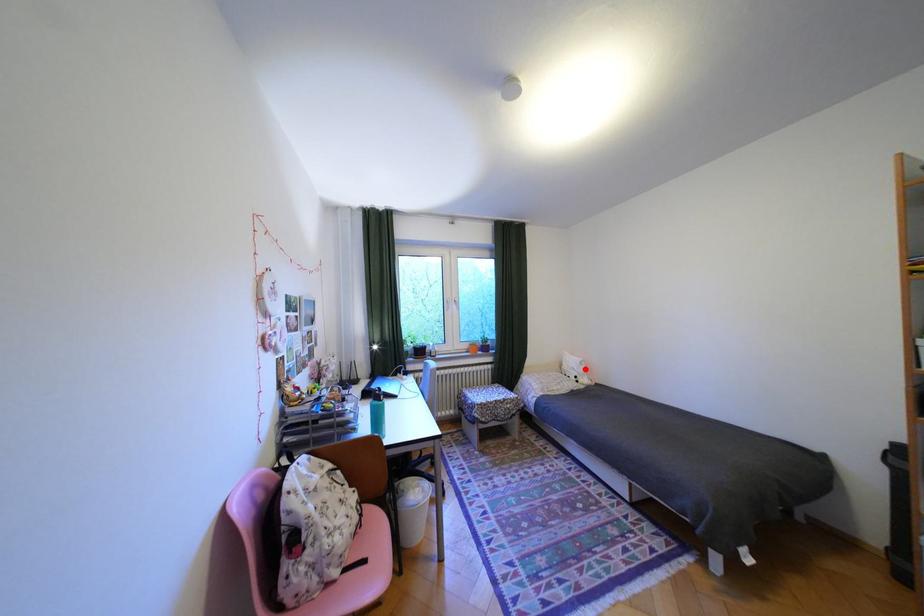
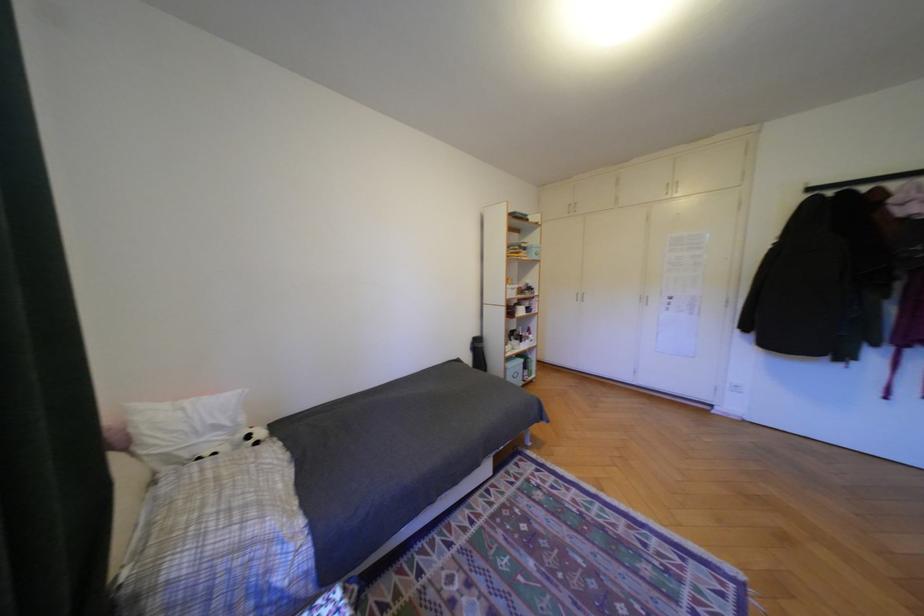
Question: A red point is marked in image1. In image2, is the corresponding 3D point closer to the camera or farther? Reply with the corresponding letter.

Choices:
 (A) The corresponding 3D point is closer.
 (B) The corresponding 3D point is farther.

Answer: (A)